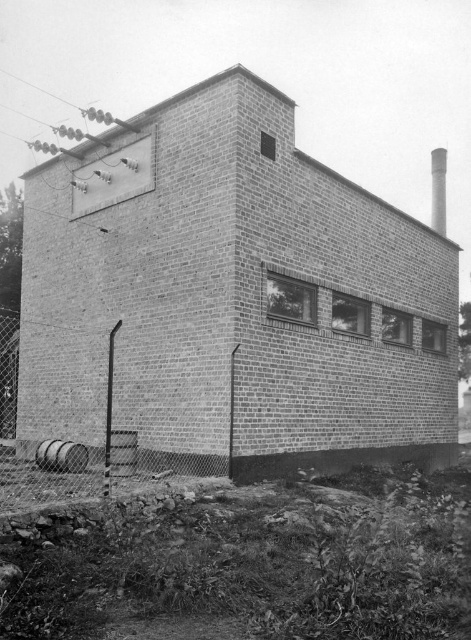
Question: Is metal chain-link fence at lower left positioned before white brick chimney at upper right?

Choices:
 (A) yes
 (B) no

Answer: (A)

Question: Which point is farther from the camera taking this photo?

Choices:
 (A) (72, 496)
 (B) (445, 198)

Answer: (B)

Question: Does metal chain-link fence at lower left have a lesser width compared to white brick chimney at upper right?

Choices:
 (A) yes
 (B) no

Answer: (A)

Question: Can you confirm if metal chain-link fence at lower left is bigger than white brick chimney at upper right?

Choices:
 (A) yes
 (B) no

Answer: (B)